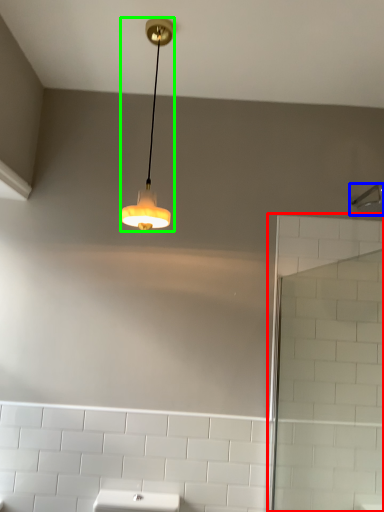
Question: Estimate the real-world distances between objects in this image. Which object is farther from screen door (highlighted by a red box), shower (highlighted by a blue box) or lamp (highlighted by a green box)?

Choices:
 (A) shower
 (B) lamp

Answer: (B)